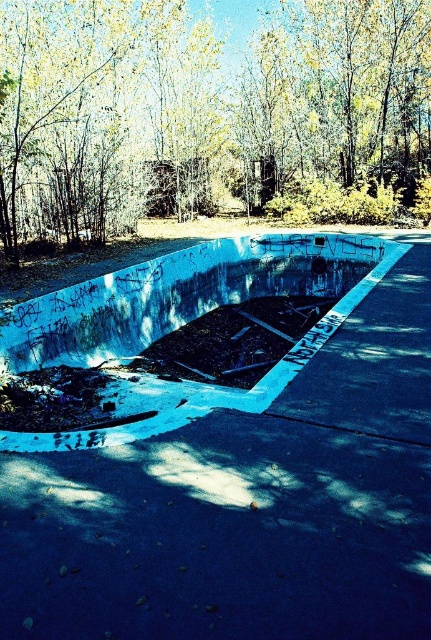
Question: Which of the following is the closest to the observer?

Choices:
 (A) smooth concrete skate park at center
 (B) concrete debris at center
 (C) yellow leafy tree at upper center

Answer: (A)

Question: Which object is positioned farthest from the smooth concrete skate park at center?

Choices:
 (A) concrete debris at center
 (B) yellow leafy tree at upper center

Answer: (B)

Question: Can you confirm if smooth concrete skate park at center is smaller than concrete debris at center?

Choices:
 (A) yes
 (B) no

Answer: (A)

Question: Does smooth concrete skate park at center come in front of yellow leafy tree at upper center?

Choices:
 (A) no
 (B) yes

Answer: (B)

Question: Does yellow leafy tree at upper center have a greater width compared to concrete debris at center?

Choices:
 (A) yes
 (B) no

Answer: (A)

Question: Which point is farther from the camera taking this photo?

Choices:
 (A) (61, 22)
 (B) (118, 616)
 (C) (208, 410)

Answer: (A)